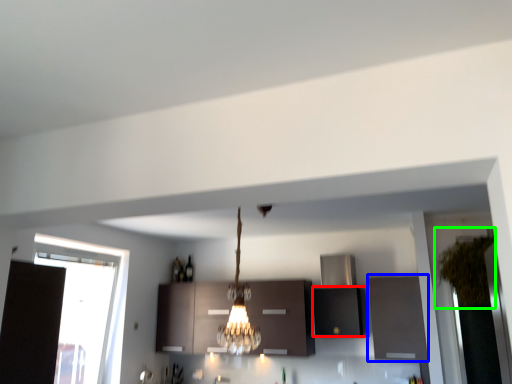
Question: Which object is the closest to the cabinetry (highlighted by a red box)? Choose among these: cabinetry (highlighted by a blue box) or plant (highlighted by a green box).

Choices:
 (A) cabinetry
 (B) plant

Answer: (A)